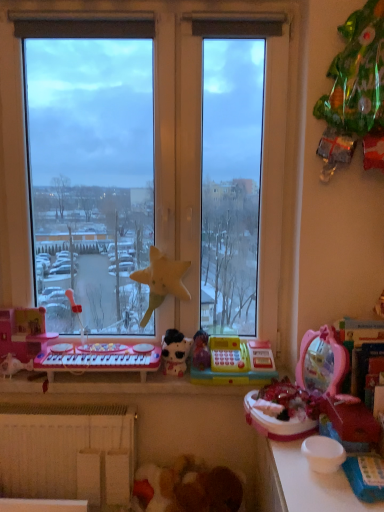
Question: Can you confirm if yellow fabric star at center, which is the 5th toy from right to left, is thinner than pink plastic musical keyboard at lower left?

Choices:
 (A) yes
 (B) no

Answer: (A)

Question: Does yellow fabric star at center, which appears as the third toy when viewed from the left, have a greater width compared to pink plastic musical keyboard at lower left?

Choices:
 (A) yes
 (B) no

Answer: (B)

Question: From the image's perspective, is yellow fabric star at center, which is the 5th toy from right to left, beneath pink plastic musical keyboard at lower left?

Choices:
 (A) no
 (B) yes

Answer: (A)

Question: Considering the relative sizes of yellow fabric star at center, which appears as the third toy when viewed from the left, and pink plastic musical keyboard at lower left in the image provided, is yellow fabric star at center, which appears as the third toy when viewed from the left, smaller than pink plastic musical keyboard at lower left?

Choices:
 (A) yes
 (B) no

Answer: (A)

Question: Is yellow fabric star at center, which is the 5th toy from right to left, not within pink plastic musical keyboard at lower left?

Choices:
 (A) no
 (B) yes

Answer: (B)

Question: From a real-world perspective, does yellow fabric star at center, which is the 5th toy from right to left, stand above pink plastic musical keyboard at lower left?

Choices:
 (A) no
 (B) yes

Answer: (B)

Question: Can you confirm if yellow fabric star at center, which appears as the third toy when viewed from the left, is positioned to the left of white matte radiator at lower left?

Choices:
 (A) yes
 (B) no

Answer: (B)

Question: From the image's perspective, is yellow fabric star at center, which appears as the third toy when viewed from the left, located beneath white matte radiator at lower left?

Choices:
 (A) yes
 (B) no

Answer: (B)

Question: From a real-world perspective, is yellow fabric star at center, which appears as the third toy when viewed from the left, physically above white matte radiator at lower left?

Choices:
 (A) yes
 (B) no

Answer: (A)

Question: Is yellow fabric star at center, which is the 5th toy from right to left, wider than white matte radiator at lower left?

Choices:
 (A) no
 (B) yes

Answer: (A)

Question: Is there a large distance between yellow fabric star at center, which appears as the third toy when viewed from the left, and white matte radiator at lower left?

Choices:
 (A) no
 (B) yes

Answer: (A)

Question: Is yellow fabric star at center, which is the 5th toy from right to left, aimed at white matte radiator at lower left?

Choices:
 (A) yes
 (B) no

Answer: (B)

Question: Is pink plastic toy keyboard at left, which is the sixth toy in right-to-left order, not near yellow fabric star at center, which is the 5th toy from right to left?

Choices:
 (A) yes
 (B) no

Answer: (B)